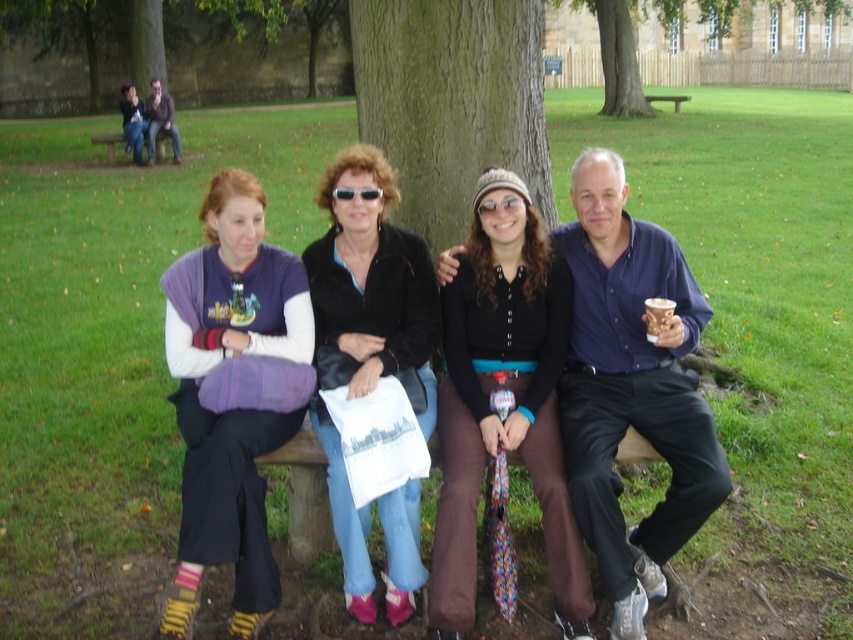
Question: Based on their relative distances, which object is farther from the brown leather jacket at upper left?

Choices:
 (A) blue shirt at center
 (B) black matte sweater at center
 (C) matte black jacket at center

Answer: (A)

Question: Does matte black jacket at center appear under black leather jacket at center?

Choices:
 (A) yes
 (B) no

Answer: (A)

Question: Among these points, which one is farthest from the camera?

Choices:
 (A) (219, 513)
 (B) (351, 195)
 (C) (125, 125)

Answer: (C)

Question: Is matte black jacket at center thinner than matte purple sweater at left?

Choices:
 (A) no
 (B) yes

Answer: (A)

Question: Which point is farther to the camera?

Choices:
 (A) (126, 104)
 (B) (657, 369)
 (C) (567, 545)
 (D) (96, 134)

Answer: (A)

Question: Does matte black jacket at center lie in front of matte purple sweater at upper left?

Choices:
 (A) no
 (B) yes

Answer: (B)